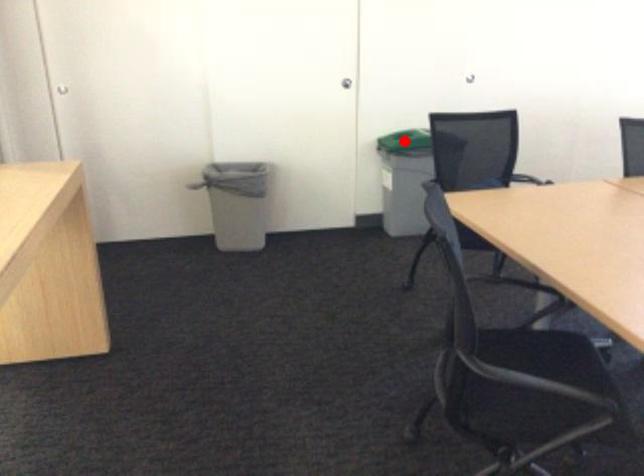
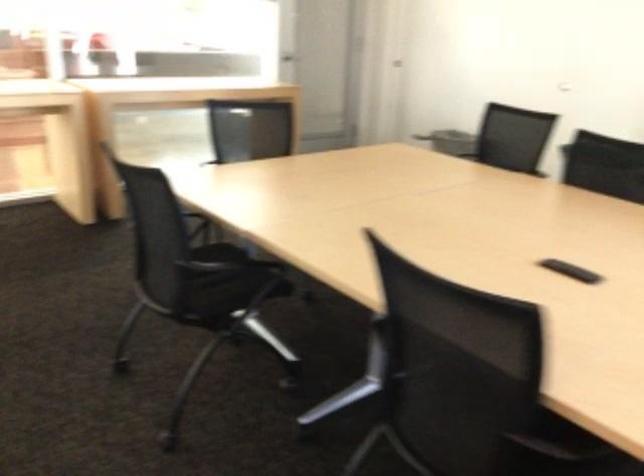
Question: I am providing you with two images of the same scene from different viewpoints. A red point is marked on the first image. Can you still see the location of the red point in image 2?

Choices:
 (A) Yes
 (B) No

Answer: (B)